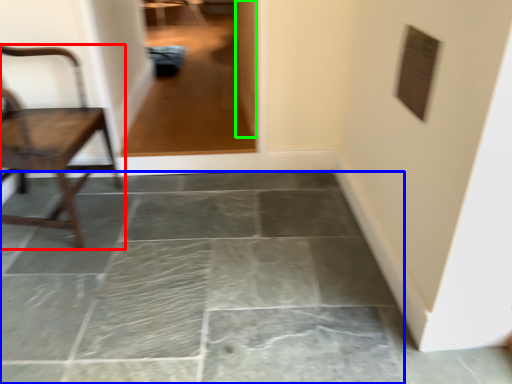
Question: Which object is the farthest from chair (highlighted by a red box)? Choose among these: concrete (highlighted by a blue box) or glass door (highlighted by a green box).

Choices:
 (A) concrete
 (B) glass door

Answer: (B)